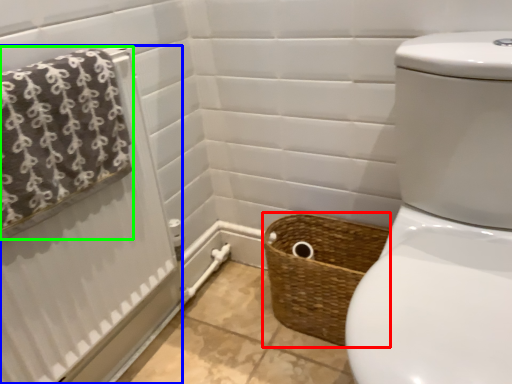
Question: Based on their relative distances, which object is farther from basket (highlighted by a red box)? Choose from shower curtain (highlighted by a blue box) and bath towel (highlighted by a green box).

Choices:
 (A) shower curtain
 (B) bath towel

Answer: (B)